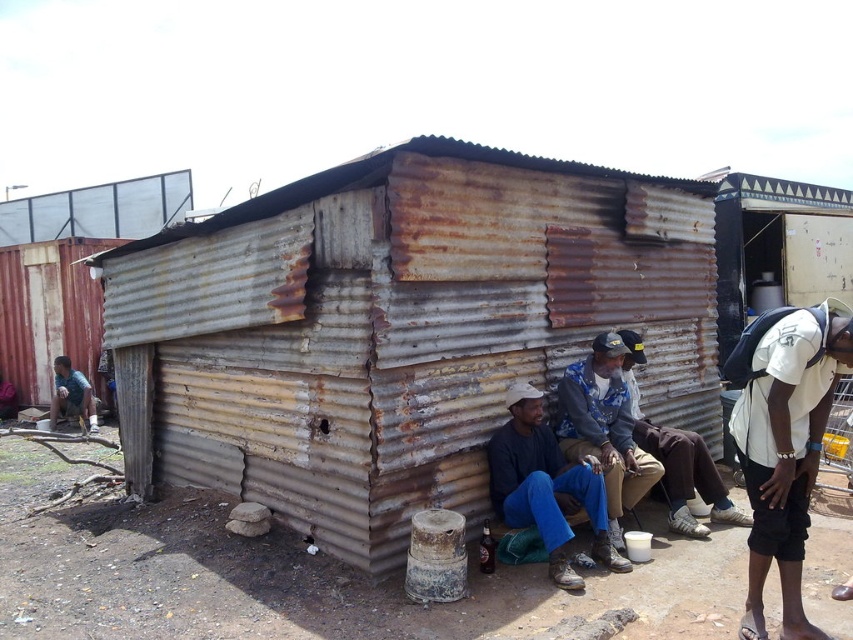
You are standing in front of the rusty corrugated metal hut at center and want to walk to the rusty corrugated metal hut at upper right. Which direction should you move to get closer to the upper right hut?

The rusty corrugated metal hut at center is in front of the rusty corrugated metal hut at upper right, so you should move backward to get closer to the upper right hut.